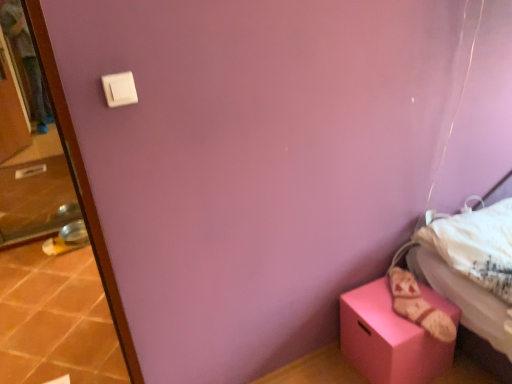
Question: In the image, is transparent glass screen door at left on the left side or the right side of white plastic light switch at upper left?

Choices:
 (A) left
 (B) right

Answer: (A)

Question: Considering the positions of transparent glass screen door at left and white plastic light switch at upper left in the image, is transparent glass screen door at left taller or shorter than white plastic light switch at upper left?

Choices:
 (A) tall
 (B) short

Answer: (A)

Question: Which object is positioned farthest from the terracotta tile at lower left?

Choices:
 (A) matte pink box at lower right
 (B) transparent glass screen door at left
 (C) white plastic light switch at upper left

Answer: (C)

Question: Which object is positioned closest to the terracotta tile at lower left?

Choices:
 (A) transparent glass screen door at left
 (B) white plastic light switch at upper left
 (C) matte pink box at lower right

Answer: (A)